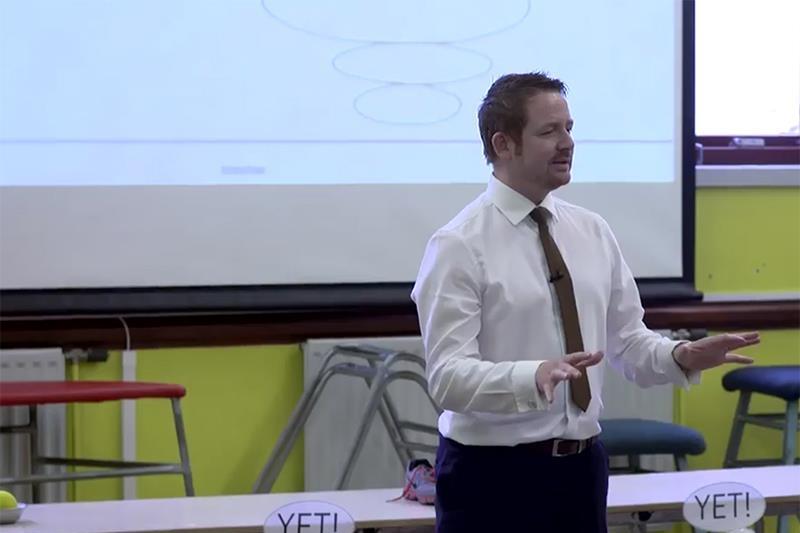
The height and width of the screenshot is (533, 800). What are the coordinates of `projector screen` in the screenshot? It's located at (302, 111).